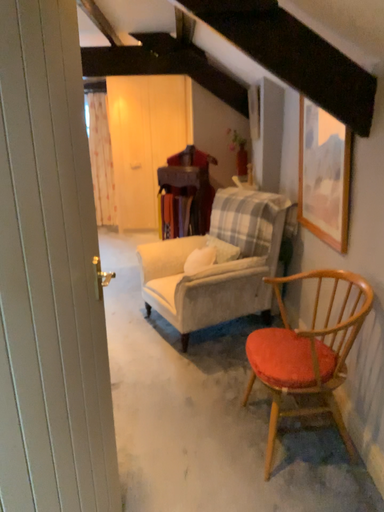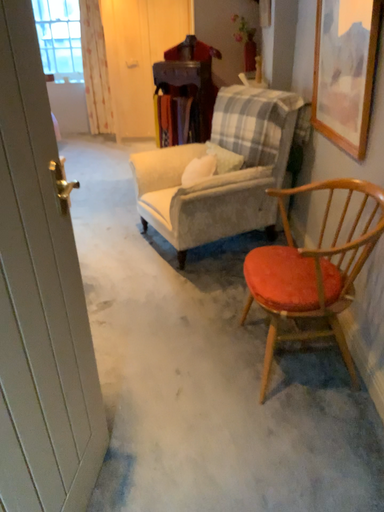
Question: How did the camera likely rotate when shooting the video?

Choices:
 (A) rotated downward
 (B) rotated upward

Answer: (A)